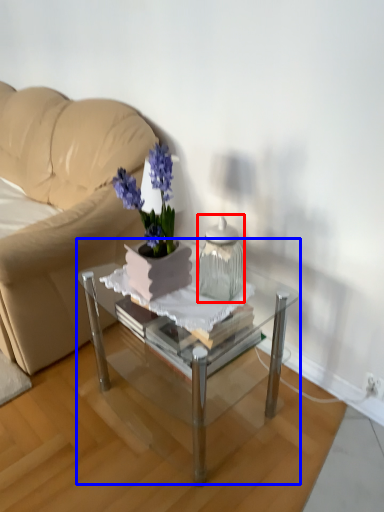
Question: Which object is further to the camera taking this photo, vase (highlighted by a red box) or coffee table (highlighted by a blue box)?

Choices:
 (A) vase
 (B) coffee table

Answer: (A)